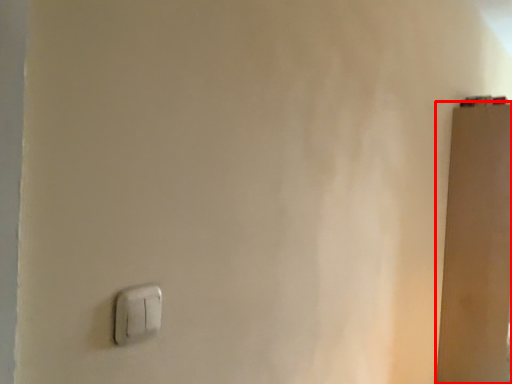
Question: From the image, what is the correct spatial relationship of door (annotated by the red box) in relation to light switch?

Choices:
 (A) right
 (B) left

Answer: (A)